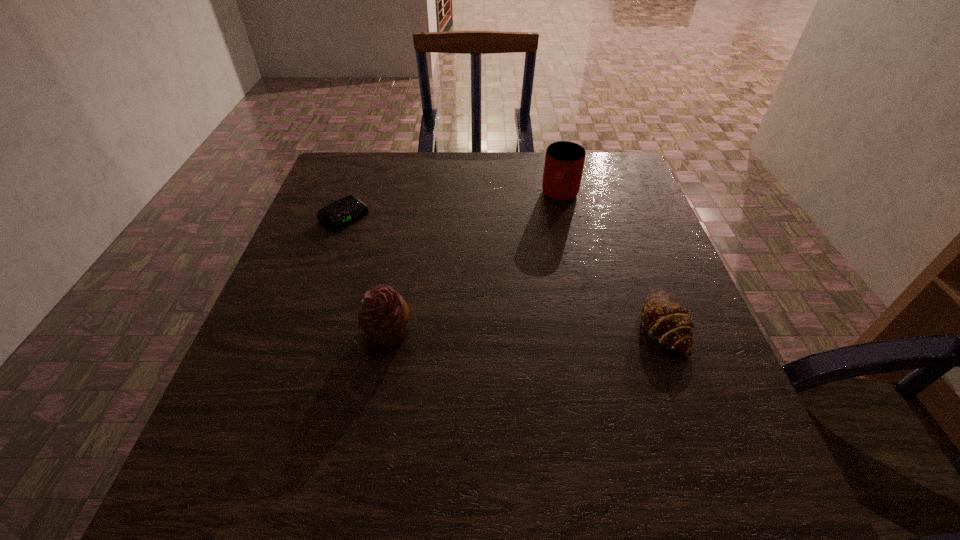
Where is `vacant point located between the cupcake and the shortest object`? The image size is (960, 540). vacant point located between the cupcake and the shortest object is located at coordinates (366, 273).

You are a GUI agent. You are given a task and a screenshot of the screen. Output one action in this format:
    pyautogui.click(x=<x>, y=<y>)
    Task: Click on the vacant area that lies between the second object from left to right and the leftmost object
    
    Given the screenshot: What is the action you would take?
    pyautogui.click(x=366, y=273)

I want to click on vacant area that lies between the leftmost object and the crescent roll, so point(504,271).

The image size is (960, 540). I want to click on unoccupied area between the third object from left to right and the third tallest object, so click(612, 261).

Identify the location of the second closest object to the cupcake. (666, 321).

The image size is (960, 540). Identify the location of object that can be found as the third closest to the shortest object. (666, 321).

Locate an element on the screen. blank space that satisfies the following two spatial constraints: 1. on the back side of the cupcake; 2. on the left side of the crescent roll is located at coordinates (388, 325).

Locate an element on the screen. This screenshot has height=540, width=960. free space that satisfies the following two spatial constraints: 1. on the front side of the second object from right to left; 2. on the right side of the crescent roll is located at coordinates (589, 325).